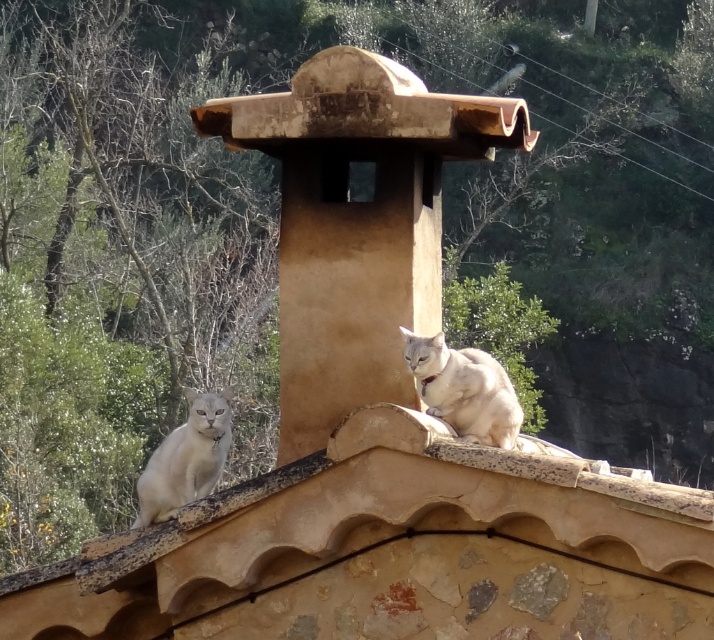
You are a photographer trying to capture both the brown textured tile roof at center and the white fur cat at upper center in a single shot. Given that the camera can only focus on objects within a 100 cm width, can you fit both subjects into the frame without moving the camera?

The brown textured tile roof at center is bigger than the white fur cat at upper center, but since the camera can focus on objects within a 100 cm width, it is possible to fit both into the frame as long as their combined width does not exceed 100 cm. However, the exact dimensions of each object are not provided, so this depends on their actual sizes relative to the camera lens and distance from the camera.

Consider the image. You are a photographer trying to capture a shot of the white fur cat at center and the brown textured tile roof at center. Based on their sizes in the image, which one would you need to zoom in more on to get a detailed closeup?

The brown textured tile roof at center is smaller than the white fur cat at center, so you would need to zoom in more on the brown textured tile roof at center to get a detailed closeup.

You are a photographer trying to capture a clear shot of the white fur cat at upper center. However, there is a brown textured tile roof at center in the way. Based on their positions, can you still see the cat clearly through the roof?

The brown textured tile roof at center is in front of the white fur cat at upper center, so the roof blocks the view of the cat, making it impossible to see the cat clearly through the roof.